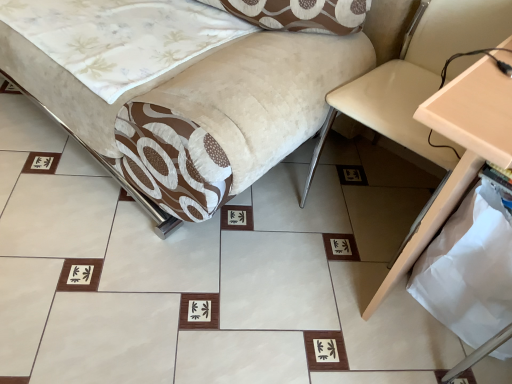
Question: Visually, is beige leather swivel chair at right positioned to the left or to the right of beige wood table at right?

Choices:
 (A) left
 (B) right

Answer: (A)

Question: Is point (395, 137) closer or farther from the camera than point (509, 124)?

Choices:
 (A) closer
 (B) farther

Answer: (B)

Question: Considering the real-world distances, which object is closest to the beige leather swivel chair at right?

Choices:
 (A) velvet beige sofa at center
 (B) beige wood table at right

Answer: (B)

Question: Which of these objects is positioned farthest from the beige wood table at right?

Choices:
 (A) beige leather swivel chair at right
 (B) velvet beige sofa at center

Answer: (B)